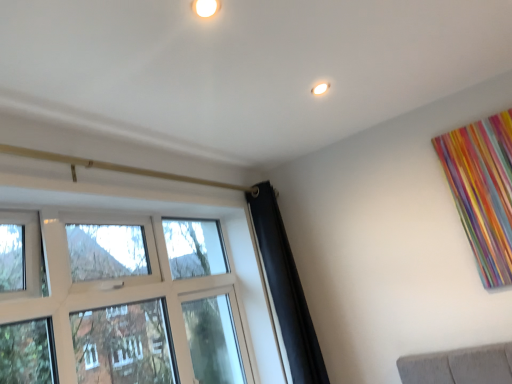
What do you see at coordinates (150, 262) in the screenshot? I see `white plastic window at lower left` at bounding box center [150, 262].

Where is `white plastic window at lower left`? This screenshot has height=384, width=512. white plastic window at lower left is located at coordinates (150, 262).

Find the location of a particular element. white plastic window at lower left is located at coordinates (150, 262).